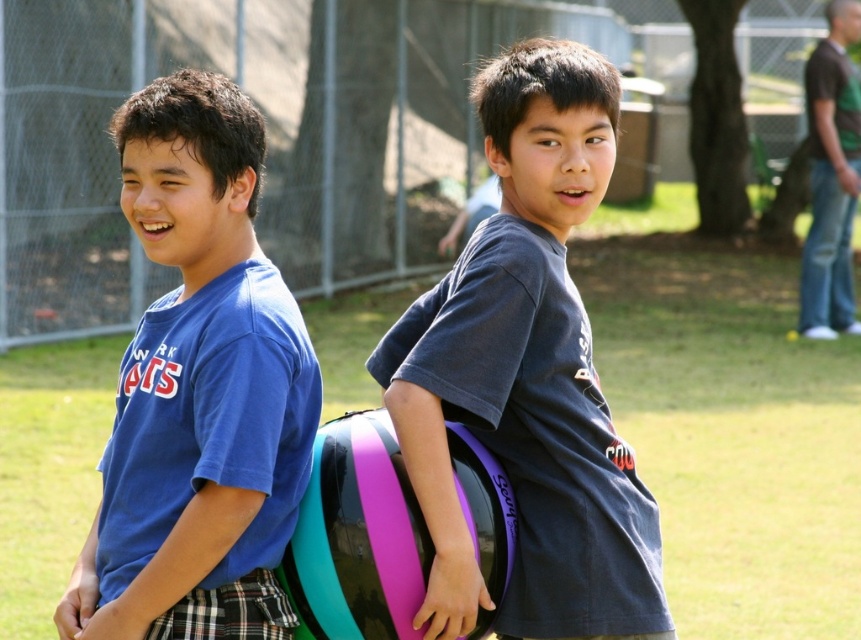
Question: Can you confirm if purple glossy frisbee at center is wider than blue matte shirt at left?

Choices:
 (A) yes
 (B) no

Answer: (A)

Question: Which point is closer to the camera?

Choices:
 (A) (158, 609)
 (B) (450, 378)

Answer: (A)

Question: Which of the following is the farthest from the observer?

Choices:
 (A) (548, 502)
 (B) (232, 288)

Answer: (A)

Question: From the image, what is the correct spatial relationship of purple glossy frisbee at center in relation to blue matte shirt at left?

Choices:
 (A) left
 (B) right

Answer: (B)

Question: Is purple glossy frisbee at center to the right of blue matte shirt at left from the viewer's perspective?

Choices:
 (A) yes
 (B) no

Answer: (A)